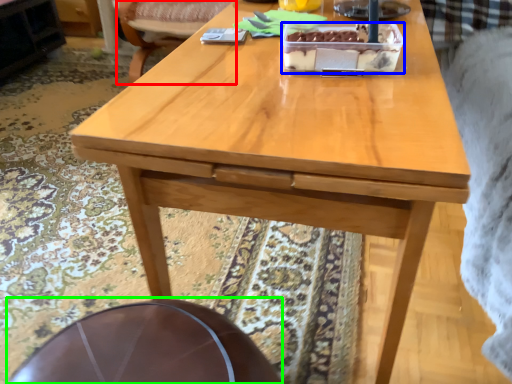
Question: Estimate the real-world distances between objects in this image. Which object is closer to chair (highlighted by a red box), cake (highlighted by a blue box) or round table (highlighted by a green box)?

Choices:
 (A) cake
 (B) round table

Answer: (A)